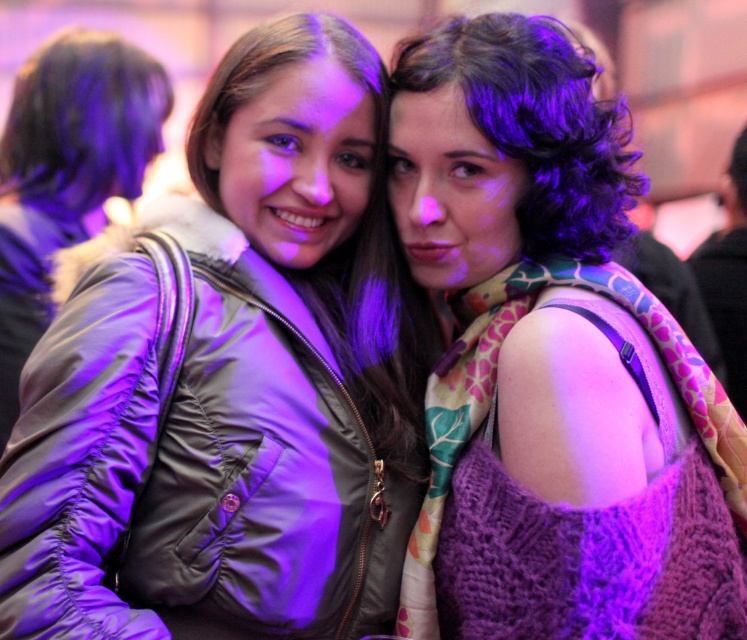
Who is more distant from viewer, [500,280] or [374,371]?

The point [374,371] is more distant.

Describe the element at coordinates (551, 362) in the screenshot. I see `knitted purple sweater at center` at that location.

Is point (560, 150) more distant than point (374, 262)?

That is False.

Locate an element on the screen. knitted purple sweater at center is located at coordinates (551, 362).

Does curly dark brown hair at upper right have a lesser width compared to dark brown hair at upper left?

Indeed, curly dark brown hair at upper right has a lesser width compared to dark brown hair at upper left.

Can you confirm if curly dark brown hair at upper right is taller than dark brown hair at upper left?

No.

Who is more distant from viewer, (613, 154) or (114, 116)?

The point (114, 116) is behind.

Where is `curly dark brown hair at upper right`? This screenshot has width=747, height=640. curly dark brown hair at upper right is located at coordinates (536, 124).

Is point (622, 349) in front of point (43, 147)?

Yes, point (622, 349) is in front of point (43, 147).

Which is more to the right, knitted purple sweater at center or dark brown hair at upper left?

From the viewer's perspective, knitted purple sweater at center appears more on the right side.

Between point (489, 529) and point (105, 164), which one is positioned in front?

Point (489, 529) is more forward.

This screenshot has height=640, width=747. I want to click on knitted purple sweater at center, so click(x=551, y=362).